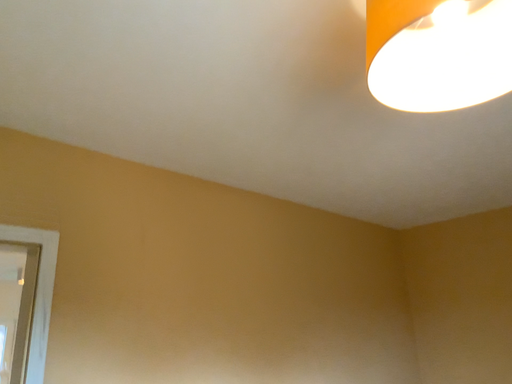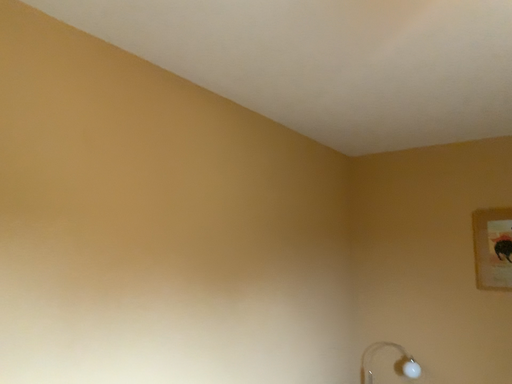
Question: How did the camera likely rotate when shooting the video?

Choices:
 (A) rotated upward
 (B) rotated downward

Answer: (B)